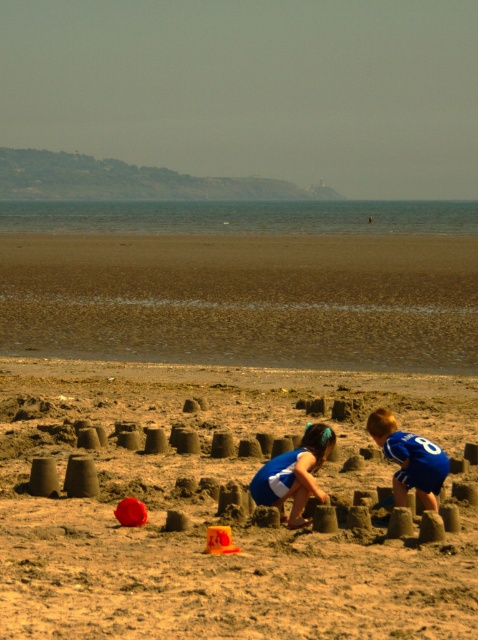
Question: Which is farther from the brown sandy beach at center?

Choices:
 (A) blue jersey at lower right
 (B) blue fabric dress at center

Answer: (A)

Question: Is brown sandy beach at lower center closer to the viewer compared to blue jersey at lower right?

Choices:
 (A) no
 (B) yes

Answer: (A)

Question: Which point is closer to the camera taking this photo?

Choices:
 (A) (1, 612)
 (B) (358, 308)
 (C) (305, 428)
 (D) (393, 419)

Answer: (A)

Question: Does brown sandy beach at lower center have a greater width compared to blue jersey at lower right?

Choices:
 (A) no
 (B) yes

Answer: (B)

Question: Does brown sandy beach at lower center have a smaller size compared to blue jersey at lower right?

Choices:
 (A) no
 (B) yes

Answer: (A)

Question: Considering the real-world distances, which object is farthest from the brown sandy beach at lower center?

Choices:
 (A) brown sandy beach at center
 (B) blue jersey at lower right
 (C) blue fabric dress at center

Answer: (B)